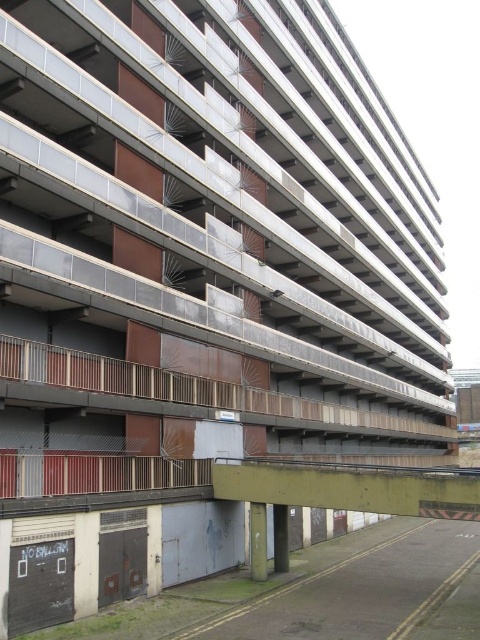
You are a delivery person with a cart that is 2 meters wide. You need to move your cart from the brown wooden balcony at lower left to the concrete bridge at lower center. Is there enough space between them for your cart to pass through?

The brown wooden balcony at lower left and concrete bridge at lower center are 6.62 meters apart, so yes, the cart can pass through since the distance between them is greater than the cart width of 2 meters.

You are standing on the sidewalk in front of the building and want to take a photo of the brown wooden balcony at lower left and the concrete bridge at lower center. Which object will appear closer to you in the photo?

The brown wooden balcony at lower left will appear closer to you in the photo because it is positioned in front of the concrete bridge at lower center.

You are an architect analyzing the building layout. You observe two points on the facade labeled as point (x=300, y=410) and point (x=368, y=476). Which point is closer to the front of the building?

Point (x=368, y=476) is closer to the front of the building because it is in front of point (x=300, y=410).